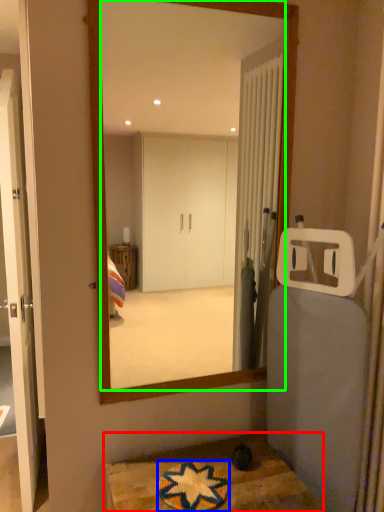
Question: Which is farther away from table (highlighted by a red box)? bath mat (highlighted by a blue box) or mirror (highlighted by a green box)?

Choices:
 (A) bath mat
 (B) mirror

Answer: (B)